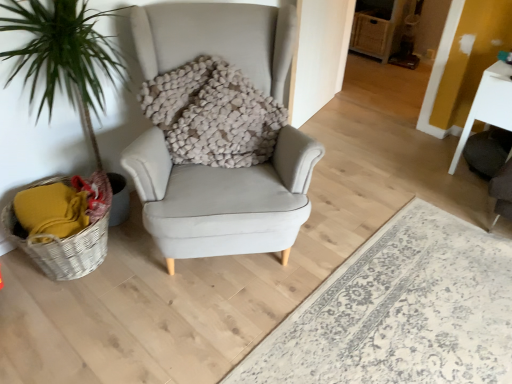
Image resolution: width=512 pixels, height=384 pixels. Identify the location of free space to the left of white glossy table at right. 423,162.